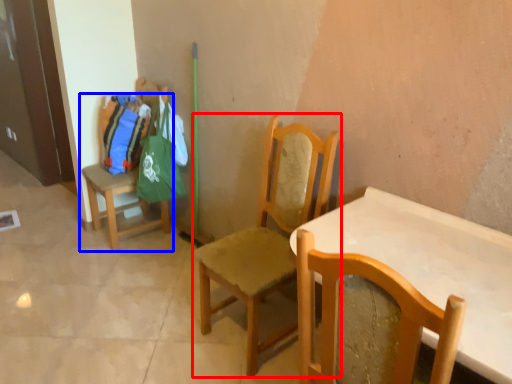
Question: Which object appears farthest to the camera in this image, chair (highlighted by a red box) or chair (highlighted by a blue box)?

Choices:
 (A) chair
 (B) chair

Answer: (B)